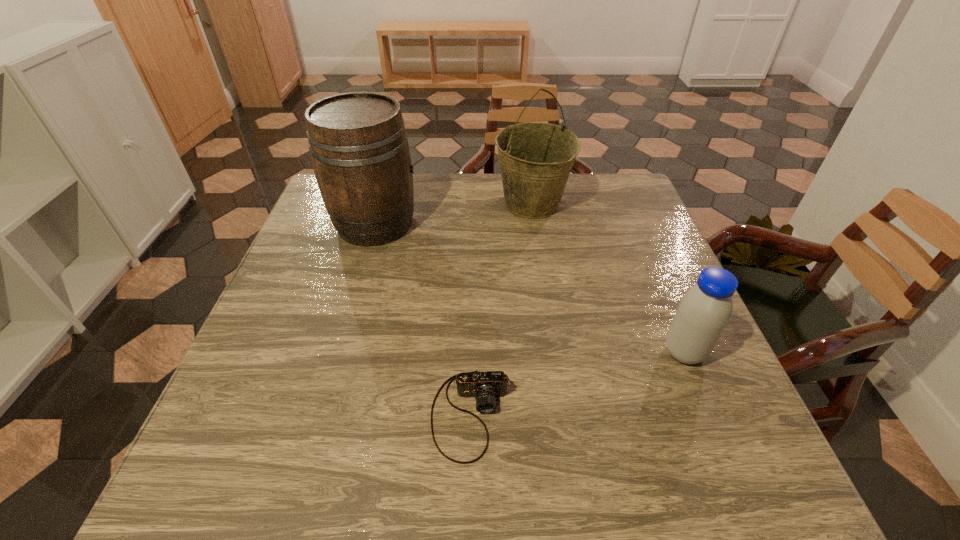
Image resolution: width=960 pixels, height=540 pixels. Identify the location of wine bucket. (536, 159).

Where is `cider`? Image resolution: width=960 pixels, height=540 pixels. cider is located at coordinates (358, 144).

The height and width of the screenshot is (540, 960). In order to click on the rightmost object in this screenshot , I will do `click(704, 311)`.

Find the location of `the third farthest object`. the third farthest object is located at coordinates (704, 311).

The width and height of the screenshot is (960, 540). I want to click on the nearest object, so click(485, 386).

I want to click on camera, so click(x=485, y=386).

Find the location of a particular element. Image resolution: width=960 pixels, height=540 pixels. vacant space situated 0.200m on the left of the wine bucket is located at coordinates (424, 204).

The width and height of the screenshot is (960, 540). In order to click on vacant area situated 0.050m on the side of the leftmost object near the bung hole in this screenshot , I will do `click(438, 224)`.

You are a GUI agent. You are given a task and a screenshot of the screen. Output one action in this format:
    pyautogui.click(x=<x>, y=<y>)
    Task: Click on the free spot located 0.200m on the front of the third tallest object
    This screenshot has width=960, height=540.
    Given the screenshot: What is the action you would take?
    pyautogui.click(x=734, y=473)

Find the location of a particular element. wine bucket situated at the far edge is located at coordinates (536, 159).